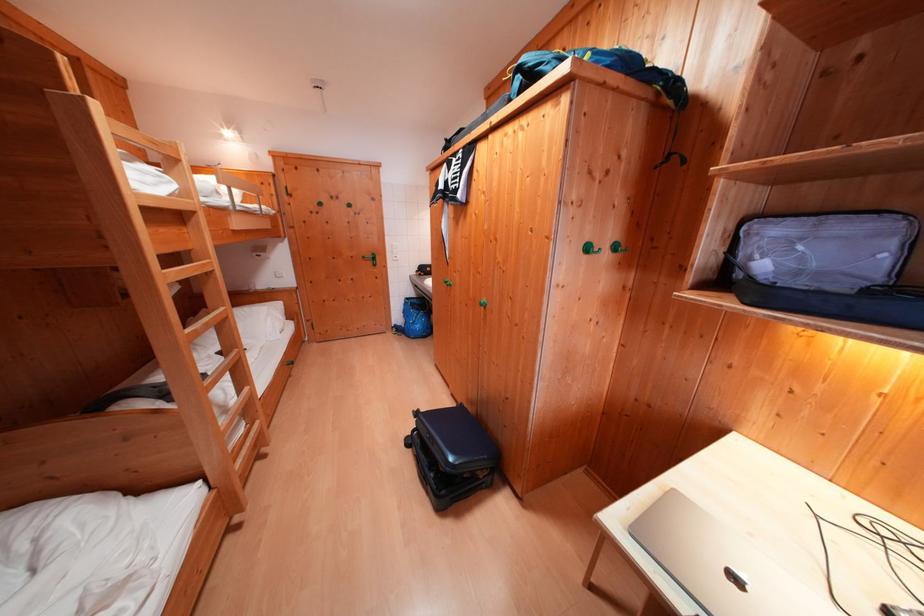
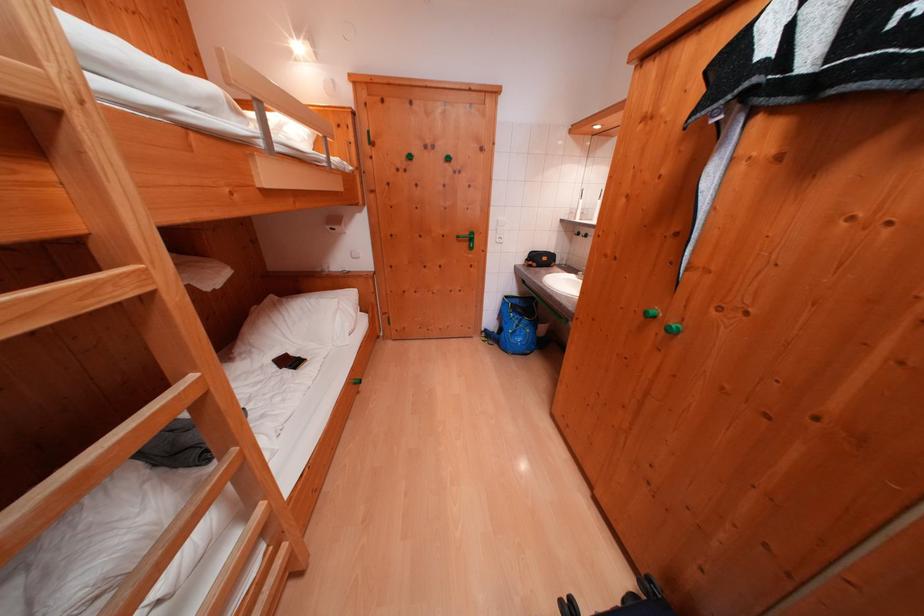
The point at (416, 302) is marked in the first image. Where is the corresponding point in the second image?

(515, 301)